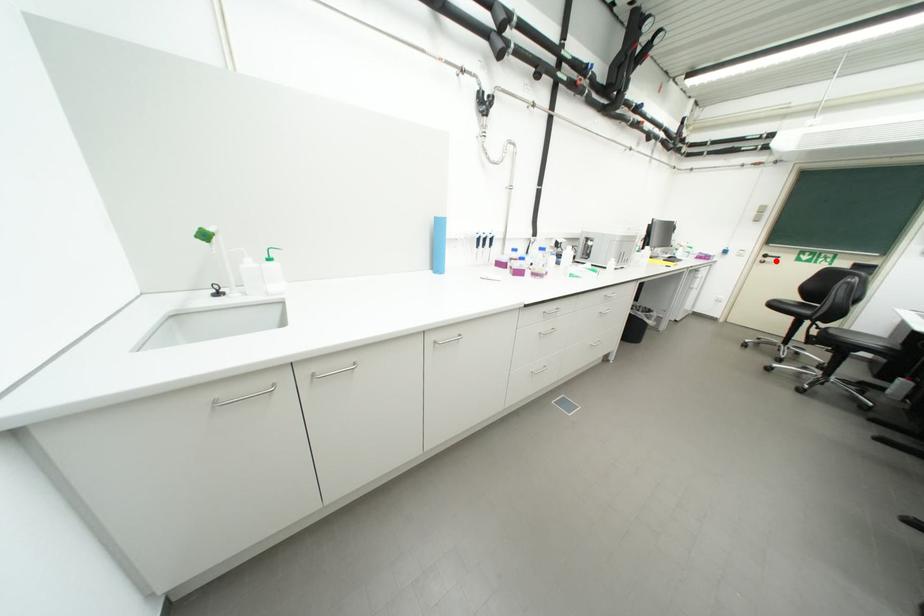
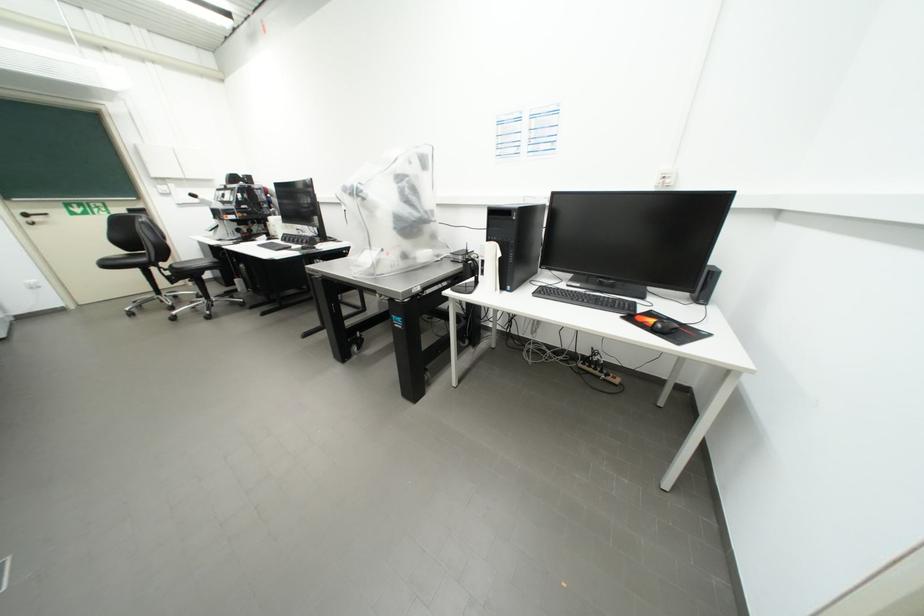
The point at the highlighted location is marked in the first image. Where is the corresponding point in the second image?

(43, 220)